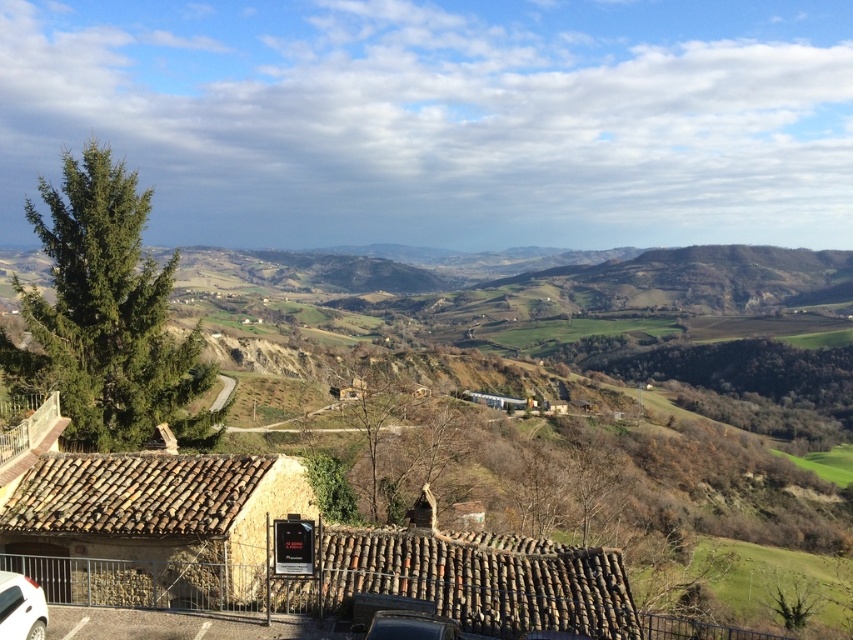
Question: Can you confirm if white glossy car at lower left is positioned to the left of shiny black car at lower center?

Choices:
 (A) no
 (B) yes

Answer: (B)

Question: Is white glossy car at lower left bigger than shiny black car at lower center?

Choices:
 (A) no
 (B) yes

Answer: (B)

Question: Does white glossy car at lower left have a smaller size compared to shiny black car at lower center?

Choices:
 (A) yes
 (B) no

Answer: (B)